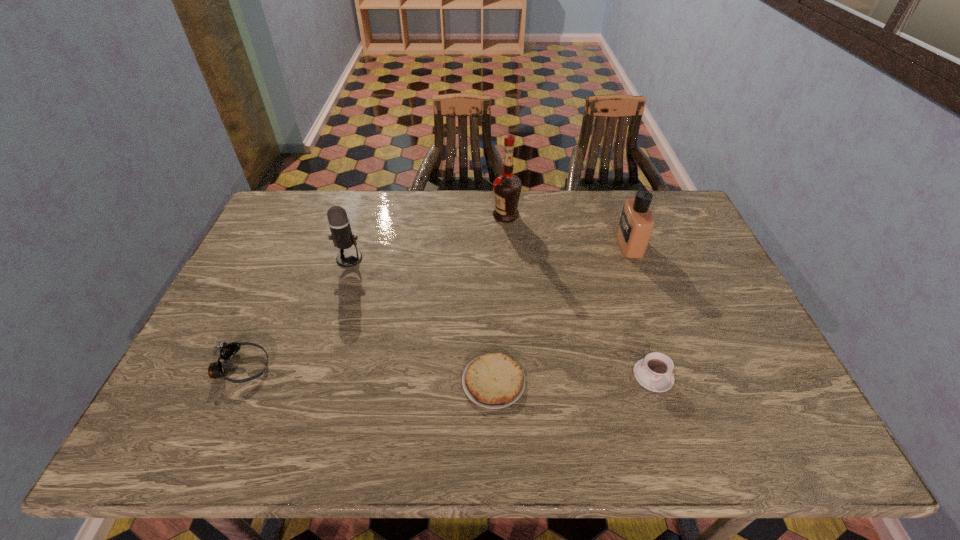
Where is `perfume located in the far edge section of the desktop`? perfume located in the far edge section of the desktop is located at coordinates (636, 223).

Image resolution: width=960 pixels, height=540 pixels. In order to click on object that is at the left edge in this screenshot , I will do `click(225, 351)`.

This screenshot has height=540, width=960. In the image, there is a desktop. Find the location of `vacant space at the far edge`. vacant space at the far edge is located at coordinates (475, 197).

This screenshot has width=960, height=540. What are the coordinates of `vacant space at the near edge of the desktop` in the screenshot? It's located at (563, 426).

This screenshot has height=540, width=960. In the image, there is a desktop. What are the coordinates of `free space at the left edge` in the screenshot? It's located at (256, 312).

Where is `vacant position at the far left corner of the desktop`? The width and height of the screenshot is (960, 540). vacant position at the far left corner of the desktop is located at coordinates (297, 208).

Identify the location of empty space that is in between the microphone and the perfume. The width and height of the screenshot is (960, 540). (490, 251).

Find the location of a particular element. This screenshot has width=960, height=540. free spot between the farthest object and the microphone is located at coordinates (428, 237).

The height and width of the screenshot is (540, 960). I want to click on blank region between the farthest object and the teacup, so click(x=580, y=295).

Locate an element on the screen. free space between the liquor and the teacup is located at coordinates (580, 295).